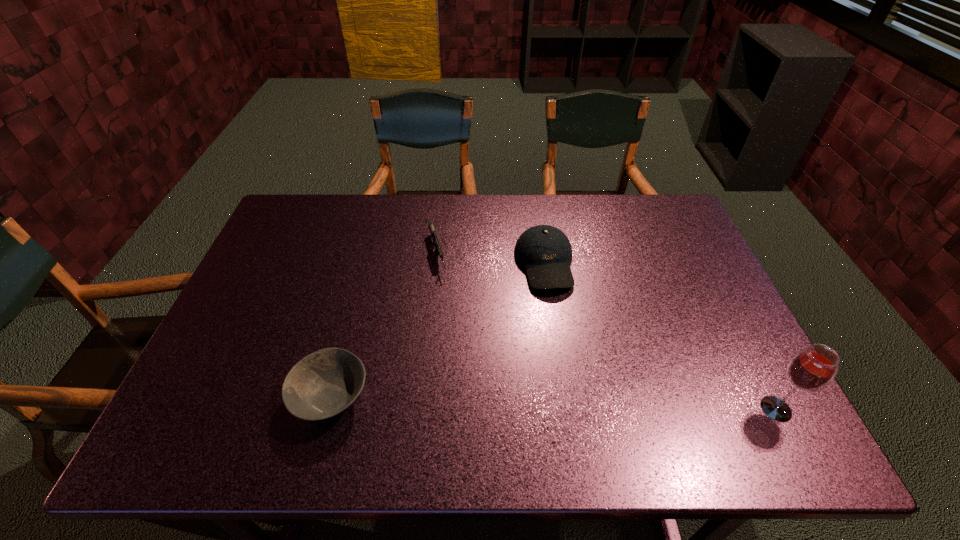
This screenshot has width=960, height=540. In order to click on free space between the second tallest object and the second object from left to right in this screenshot , I will do `click(491, 259)`.

The width and height of the screenshot is (960, 540). In order to click on unoccupied position between the bowl and the third shortest object in this screenshot , I will do `click(438, 330)`.

I want to click on vacant space that is in between the second tallest object and the gun, so pos(491,259).

The height and width of the screenshot is (540, 960). Find the location of `empty space that is in between the leftmost object and the wineglass`. empty space that is in between the leftmost object and the wineglass is located at coordinates (553, 403).

The width and height of the screenshot is (960, 540). Identify the location of free space between the tallest object and the leftmost object. (553, 403).

The image size is (960, 540). What are the coordinates of `vacant area that lies between the second tallest object and the bowl` in the screenshot? It's located at (438, 330).

You are a GUI agent. You are given a task and a screenshot of the screen. Output one action in this format:
    pyautogui.click(x=<x>, y=<y>)
    Task: Click on the vacant region between the second object from right to left and the tallest object
    
    Given the screenshot: What is the action you would take?
    tap(660, 336)

Identify which object is the second nearest to the gun. Please provide its 2D coordinates. Your answer should be formatted as a tuple, i.e. [(x, y)], where the tuple contains the x and y coordinates of a point satisfying the conditions above.

[(325, 383)]

Point out which object is positioned as the nearest to the second tallest object. Please provide its 2D coordinates. Your answer should be formatted as a tuple, i.e. [(x, y)], where the tuple contains the x and y coordinates of a point satisfying the conditions above.

[(438, 248)]

Find the location of a particular element. This screenshot has width=960, height=540. vacant space that satisfies the following two spatial constraints: 1. on the back side of the leftmost object; 2. on the left side of the third object from left to right is located at coordinates (366, 264).